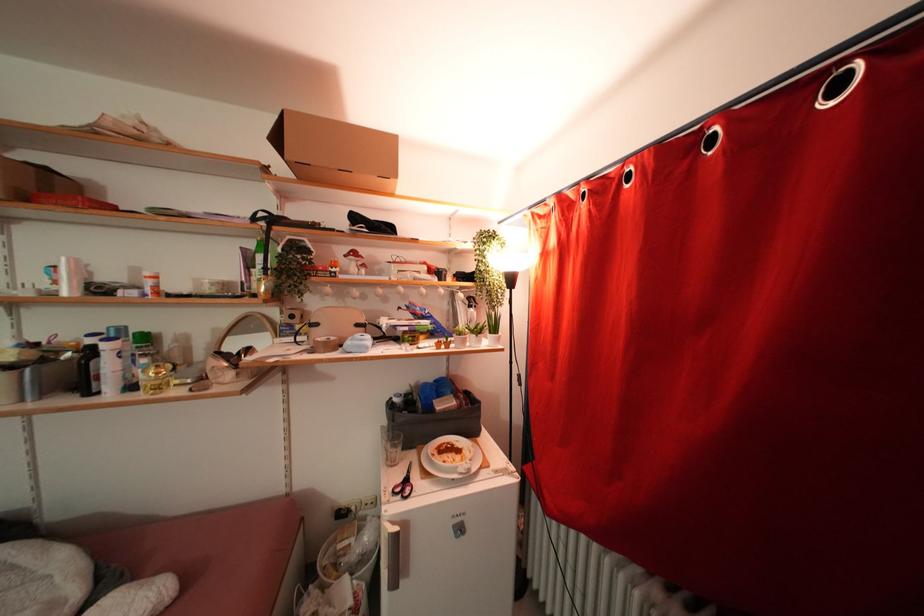
Find where to lift the white bowl. Please return your answer as a coordinate pair (x, y).

(451, 458)